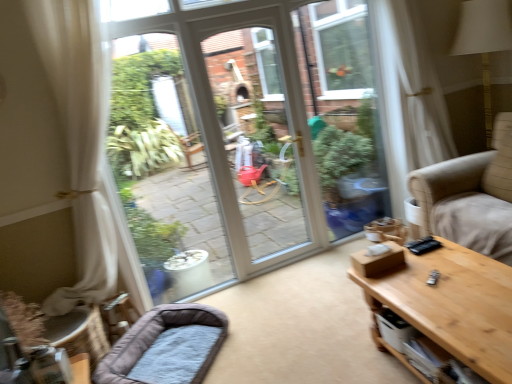
Image resolution: width=512 pixels, height=384 pixels. Find the location of `empty space that is ontop of wooden table at right (from a real-world perspective)`. empty space that is ontop of wooden table at right (from a real-world perspective) is located at coordinates (449, 281).